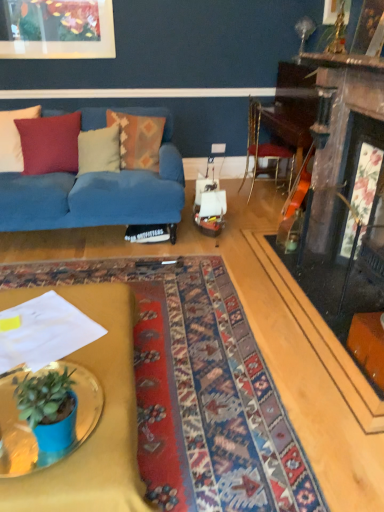
How much space does white cotton pillow at left, which appears as the 1th pillow when viewed from the left, occupy horizontally?

8.00 inches.

How much space does textured orange pillow at center, which ranks as the fourth pillow in left-to-right order, occupy vertically?

The height of textured orange pillow at center, which ranks as the fourth pillow in left-to-right order, is 20.09 inches.

The width and height of the screenshot is (384, 512). Find the location of `carpeted rug at center`. carpeted rug at center is located at coordinates (197, 388).

Find the location of a particular element. textured woolen pillow at left, the second pillow positioned from the left is located at coordinates (50, 143).

I want to click on metallic gold desk at center, so click(98, 423).

What do you see at coordinates (98, 192) in the screenshot? I see `blue fabric couch at left` at bounding box center [98, 192].

Where is `blue fabric couch at left`? blue fabric couch at left is located at coordinates (98, 192).

What are the coordinates of `white cotton pillow at left, which appears as the 4th pillow when viewed from the right` in the screenshot? It's located at (13, 138).

Can you confirm if blue fabric couch at left is smaller than blue glossy table at lower left?

No, blue fabric couch at left is not smaller than blue glossy table at lower left.

What's the angular difference between blue fabric couch at left and blue glossy table at lower left's facing directions?

88.5 degrees separate the facing orientations of blue fabric couch at left and blue glossy table at lower left.

From the picture: From a real-world perspective, who is located lower, blue fabric couch at left or blue glossy table at lower left?

blue glossy table at lower left is physically lower.

Can you confirm if blue fabric couch at left is taller than blue glossy table at lower left?

Indeed, blue fabric couch at left has a greater height compared to blue glossy table at lower left.

From a real-world perspective, is blue fabric couch at left under white cotton pillow at left, which appears as the 4th pillow when viewed from the right?

Indeed, from a real-world perspective, blue fabric couch at left is positioned beneath white cotton pillow at left, which appears as the 4th pillow when viewed from the right.

Which is closer, (147, 222) or (20, 162)?

Point (147, 222) appears to be closer to the viewer than point (20, 162).

From the image's perspective, is blue fabric couch at left positioned above or below white cotton pillow at left, which appears as the 4th pillow when viewed from the right?

Based on their image positions, blue fabric couch at left is located beneath white cotton pillow at left, which appears as the 4th pillow when viewed from the right.

Can you confirm if blue fabric couch at left is thinner than white cotton pillow at left, which appears as the 1th pillow when viewed from the left?

No.

From the image's perspective, relative to blue glossy table at lower left, is white cotton pillow at left, which appears as the 1th pillow when viewed from the left, above or below?

white cotton pillow at left, which appears as the 1th pillow when viewed from the left, is situated higher than blue glossy table at lower left in the image.

In terms of height, does white cotton pillow at left, which appears as the 4th pillow when viewed from the right, look taller or shorter compared to blue glossy table at lower left?

Considering their sizes, white cotton pillow at left, which appears as the 4th pillow when viewed from the right, has more height than blue glossy table at lower left.

Is white cotton pillow at left, which appears as the 1th pillow when viewed from the left, positioned behind blue glossy table at lower left?

Yes, the depth of white cotton pillow at left, which appears as the 1th pillow when viewed from the left, is greater than that of blue glossy table at lower left.

Could you tell me if white cotton pillow at left, which appears as the 4th pillow when viewed from the right, is facing blue glossy table at lower left?

Yes, white cotton pillow at left, which appears as the 4th pillow when viewed from the right, is turned towards blue glossy table at lower left.

How many degrees apart are the facing directions of soft cotton pillow at center, which is the 2th pillow in right-to-left order, and white cotton pillow at left, which appears as the 1th pillow when viewed from the left?

25.2 degrees separate the facing orientations of soft cotton pillow at center, which is the 2th pillow in right-to-left order, and white cotton pillow at left, which appears as the 1th pillow when viewed from the left.

Is white cotton pillow at left, which appears as the 4th pillow when viewed from the right, at the back of soft cotton pillow at center, which is the 2th pillow in right-to-left order?

No, soft cotton pillow at center, which is the 2th pillow in right-to-left order, is not facing away from white cotton pillow at left, which appears as the 4th pillow when viewed from the right.

Considering the relative sizes of soft cotton pillow at center, the third pillow from the left, and white cotton pillow at left, which appears as the 4th pillow when viewed from the right, in the image provided, is soft cotton pillow at center, the third pillow from the left, thinner than white cotton pillow at left, which appears as the 4th pillow when viewed from the right,?

In fact, soft cotton pillow at center, the third pillow from the left, might be wider than white cotton pillow at left, which appears as the 4th pillow when viewed from the right.

Find the location of a particular element. the 2nd pillow behind the white cotton pillow at left, which appears as the 4th pillow when viewed from the right is located at coordinates (99, 150).

What are the coordinates of `table beneath the textured orange pillow at center, which ranks as the fourth pillow in left-to-right order (from a real-world perspective)` in the screenshot? It's located at (30, 428).

Which of these two, textured orange pillow at center, which ranks as the fourth pillow in left-to-right order, or blue glossy table at lower left, is smaller?

blue glossy table at lower left is smaller.

Which is farther, (151,120) or (84,411)?

The point (151,120) is farther from the camera.

Considering the sizes of objects textured orange pillow at center, which ranks as the fourth pillow in left-to-right order, and blue glossy table at lower left in the image provided, who is taller, textured orange pillow at center, which ranks as the fourth pillow in left-to-right order, or blue glossy table at lower left?

textured orange pillow at center, which ranks as the fourth pillow in left-to-right order.

Could blue glossy table at lower left be considered to be inside soft cotton pillow at center, the third pillow from the left?

Actually, blue glossy table at lower left is outside soft cotton pillow at center, the third pillow from the left.

Is the position of soft cotton pillow at center, the third pillow from the left, more distant than that of blue glossy table at lower left?

Yes, soft cotton pillow at center, the third pillow from the left, is behind blue glossy table at lower left.

Which is behind, point (107, 127) or point (100, 390)?

The point (107, 127) is farther.

Locate an element on the screen. Image resolution: width=384 pixels, height=512 pixels. chair to the right of soft cotton pillow at center, which is the 2th pillow in right-to-left order is located at coordinates (263, 149).

Is metallic gold chair at center-right positioned beyond the bounds of soft cotton pillow at center, which is the 2th pillow in right-to-left order?

Indeed, metallic gold chair at center-right is completely outside soft cotton pillow at center, which is the 2th pillow in right-to-left order.

Considering the positions of objects metallic gold chair at center-right and soft cotton pillow at center, the third pillow from the left, in the image provided, who is more to the left, metallic gold chair at center-right or soft cotton pillow at center, the third pillow from the left,?

soft cotton pillow at center, the third pillow from the left.

From a real-world perspective, which is physically below, metallic gold chair at center-right or soft cotton pillow at center, which is the 2th pillow in right-to-left order?

In real-world perspective, metallic gold chair at center-right is lower.

Locate an element on the screen. The height and width of the screenshot is (512, 384). table below the blue fabric couch at left (from a real-world perspective) is located at coordinates (30, 428).

The width and height of the screenshot is (384, 512). Find the location of `studio couch lying below the white cotton pillow at left, which appears as the 1th pillow when viewed from the left (from the image's perspective)`. studio couch lying below the white cotton pillow at left, which appears as the 1th pillow when viewed from the left (from the image's perspective) is located at coordinates (98, 192).

Estimate the real-world distances between objects in this image. Which object is further from soft cotton pillow at center, which is the 2th pillow in right-to-left order, metallic gold chair at center-right or textured orange pillow at center, the first pillow positioned from the right?

metallic gold chair at center-right.

Estimate the real-world distances between objects in this image. Which object is further from blue fabric couch at left, carpeted rug at center or blue glossy table at lower left?

The object further to blue fabric couch at left is blue glossy table at lower left.

Which object lies further to the anchor point metallic gold chair at center-right, textured woolen pillow at left, the second pillow positioned from the left, or carpeted rug at center?

The object further to metallic gold chair at center-right is carpeted rug at center.

Estimate the real-world distances between objects in this image. Which object is further from white cotton pillow at left, which appears as the 1th pillow when viewed from the left, carpeted rug at center or textured woolen pillow at left, positioned as the third pillow in right-to-left order?

carpeted rug at center lies further to white cotton pillow at left, which appears as the 1th pillow when viewed from the left, than the other object.

Based on their spatial positions, is metallic gold chair at center-right or textured woolen pillow at left, the second pillow positioned from the left, further from textured orange pillow at center, the first pillow positioned from the right?

Among the two, metallic gold chair at center-right is located further to textured orange pillow at center, the first pillow positioned from the right.

Considering their positions, is textured orange pillow at center, the first pillow positioned from the right, positioned closer to metallic gold chair at center-right than carpeted rug at center?

textured orange pillow at center, the first pillow positioned from the right.

Looking at the image, which one is located further to carpeted rug at center, blue glossy table at lower left or textured orange pillow at center, the first pillow positioned from the right?

Based on the image, textured orange pillow at center, the first pillow positioned from the right, appears to be further to carpeted rug at center.

Based on their spatial positions, is metallic gold desk at center or blue glossy table at lower left closer to blue fabric couch at left?

metallic gold desk at center is positioned closer to the anchor blue fabric couch at left.

Identify the location of mat between blue glossy table at lower left and textured orange pillow at center, the first pillow positioned from the right, in the front-back direction. (197, 388).

The height and width of the screenshot is (512, 384). I want to click on mat between metallic gold desk at center and soft cotton pillow at center, which is the 2th pillow in right-to-left order, along the z-axis, so click(x=197, y=388).

This screenshot has width=384, height=512. What are the coordinates of `studio couch located between blue glossy table at lower left and metallic gold chair at center-right in the depth direction` in the screenshot? It's located at (98, 192).

Where is `studio couch between metallic gold desk at center and textured woolen pillow at left, positioned as the third pillow in right-to-left order, in the front-back direction`? Image resolution: width=384 pixels, height=512 pixels. studio couch between metallic gold desk at center and textured woolen pillow at left, positioned as the third pillow in right-to-left order, in the front-back direction is located at coordinates (98, 192).